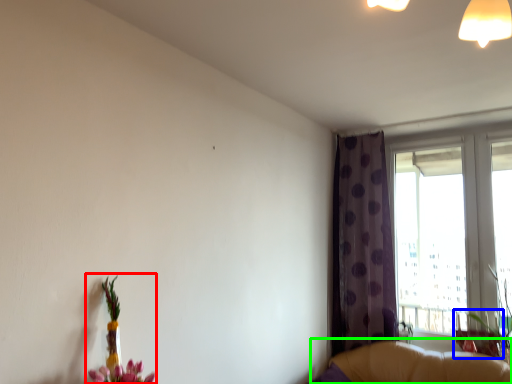
Question: Considering the real-world distances, which object is farthest from floral arrangement (highlighted by a red box)? swivel chair (highlighted by a blue box) or couch (highlighted by a green box)?

Choices:
 (A) swivel chair
 (B) couch

Answer: (A)